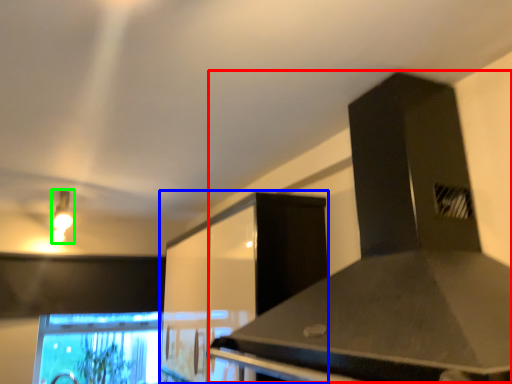
Question: Considering the real-world distances, which object is closest to vent (highlighted by a red box)? cabinetry (highlighted by a blue box) or light fixture (highlighted by a green box).

Choices:
 (A) cabinetry
 (B) light fixture

Answer: (A)